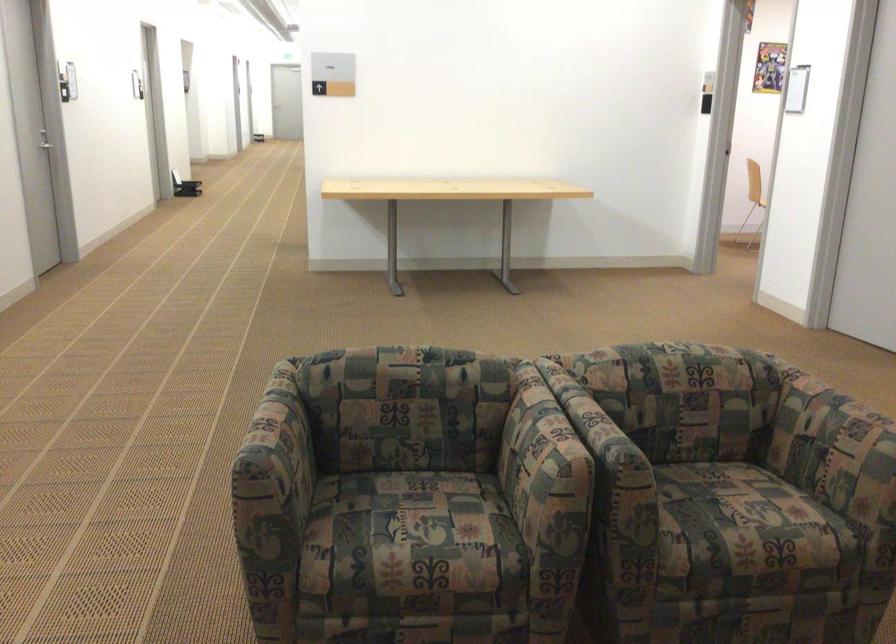
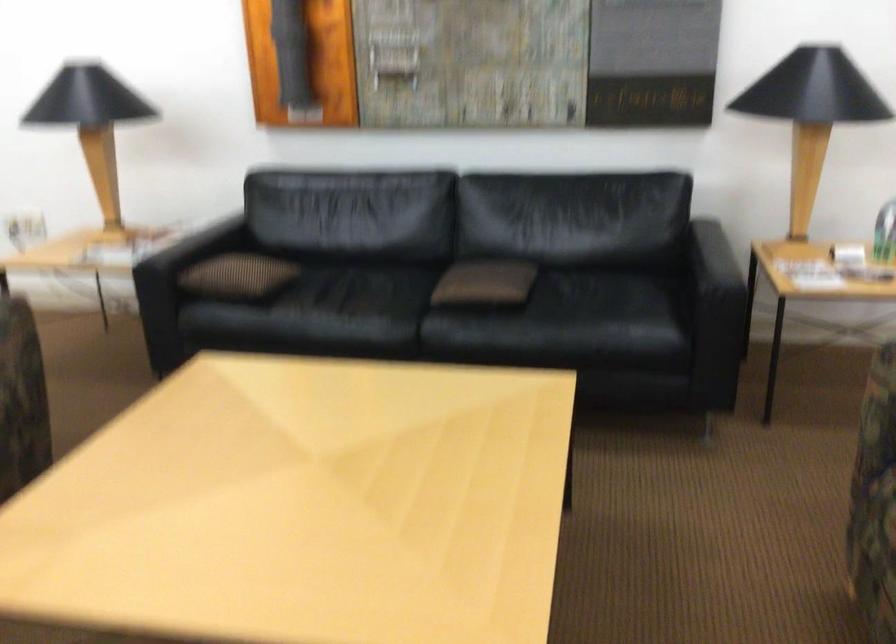
First-person continuous shooting, in which direction is the camera rotating?

The camera rotated toward right-down.